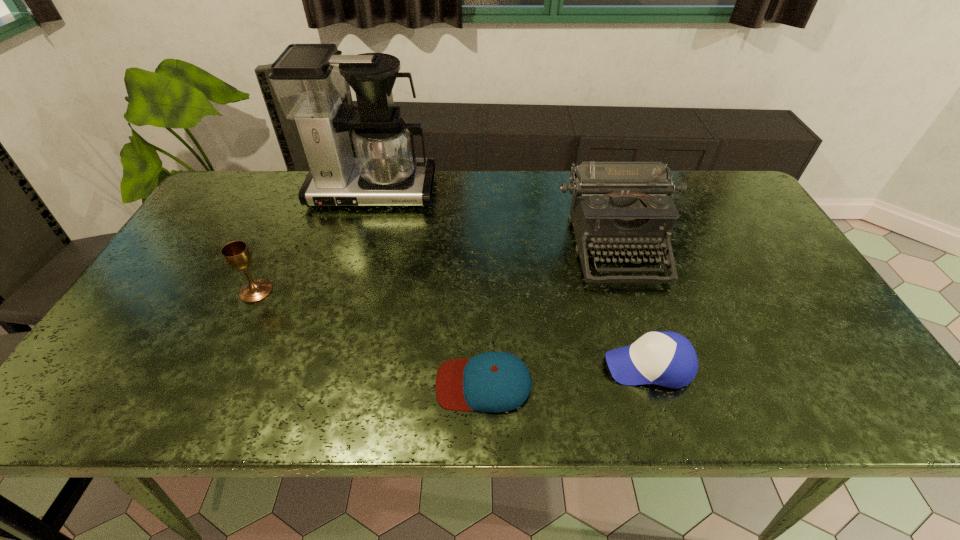
In order to click on vacant area situated on the front-facing side of the taller baseball cap in this screenshot , I will do `click(458, 366)`.

Locate an element on the screen. vacant space located on the front-facing side of the taller baseball cap is located at coordinates (549, 366).

Image resolution: width=960 pixels, height=540 pixels. I want to click on vacant space located 0.380m on the front-facing side of the taller baseball cap, so click(431, 366).

In order to click on vacant space located 0.050m with the bill of the shorter baseball cap facing forward in this screenshot , I will do `click(413, 384)`.

This screenshot has height=540, width=960. I want to click on vacant space located with the bill of the shorter baseball cap facing forward, so click(319, 384).

I want to click on free space located 0.270m with the bill of the shorter baseball cap facing forward, so click(x=309, y=384).

At what (x,y) coordinates should I click in order to perform the action: click on coffee maker that is at the far edge. Please return your answer as a coordinate pair (x, y). Image resolution: width=960 pixels, height=540 pixels. Looking at the image, I should click on (309, 81).

At what (x,y) coordinates should I click in order to perform the action: click on typewriter present at the far edge. Please return your answer as a coordinate pair (x, y). Looking at the image, I should click on click(616, 205).

In the image, there is a desktop. Identify the location of vacant space at the far edge. (417, 210).

You are a GUI agent. You are given a task and a screenshot of the screen. Output one action in this format:
    pyautogui.click(x=<x>, y=<y>)
    Task: Click on the free space at the near edge of the desktop
    This screenshot has height=540, width=960.
    Given the screenshot: What is the action you would take?
    pyautogui.click(x=375, y=381)